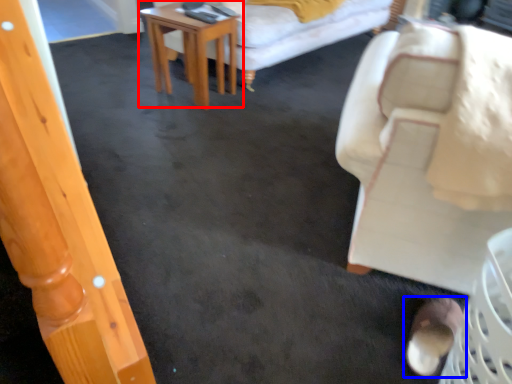
Question: Which of the following is the closest to the observer, table (highlighted by a red box) or footwear (highlighted by a blue box)?

Choices:
 (A) table
 (B) footwear

Answer: (B)